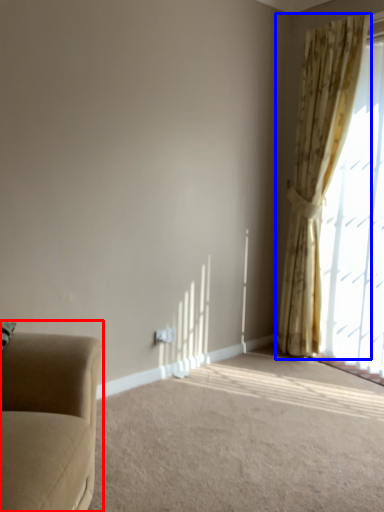
Question: Which object is further to the camera taking this photo, studio couch (highlighted by a red box) or curtain (highlighted by a blue box)?

Choices:
 (A) studio couch
 (B) curtain

Answer: (B)